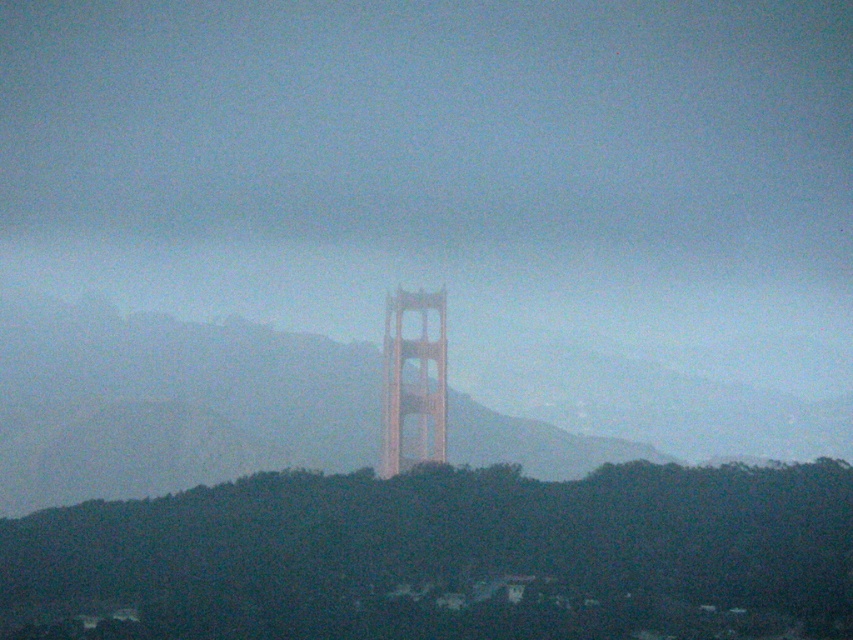
Question: Which point is farther from the camera taking this photo?

Choices:
 (A) (375, 592)
 (B) (390, 413)

Answer: (A)

Question: Does dark green foliage at center appear under golden brown steel tower at center?

Choices:
 (A) no
 (B) yes

Answer: (B)

Question: Does dark green foliage at center appear under golden brown steel tower at center?

Choices:
 (A) yes
 (B) no

Answer: (A)

Question: Which point is closer to the camera?

Choices:
 (A) (683, 486)
 (B) (387, 310)

Answer: (B)

Question: Which of the following is the closest to the observer?

Choices:
 (A) dark green foliage at center
 (B) golden brown steel tower at center

Answer: (B)

Question: Does dark green foliage at center have a greater width compared to golden brown steel tower at center?

Choices:
 (A) no
 (B) yes

Answer: (B)